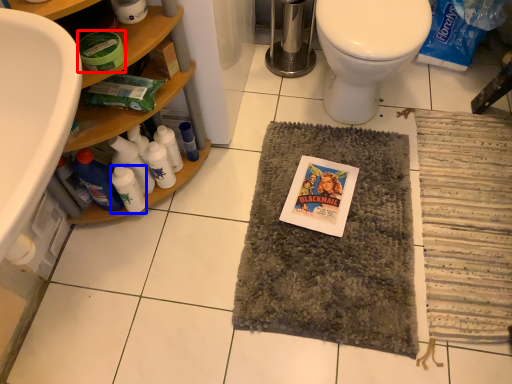
Question: Which of the following is the closest to the observer, product (highlighted by a red box) or bottle (highlighted by a blue box)?

Choices:
 (A) product
 (B) bottle

Answer: (A)